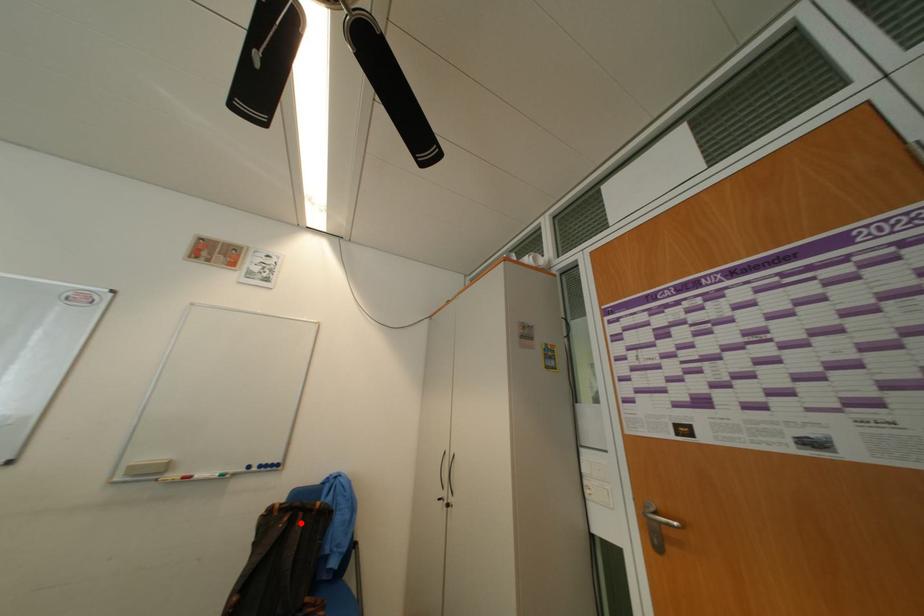
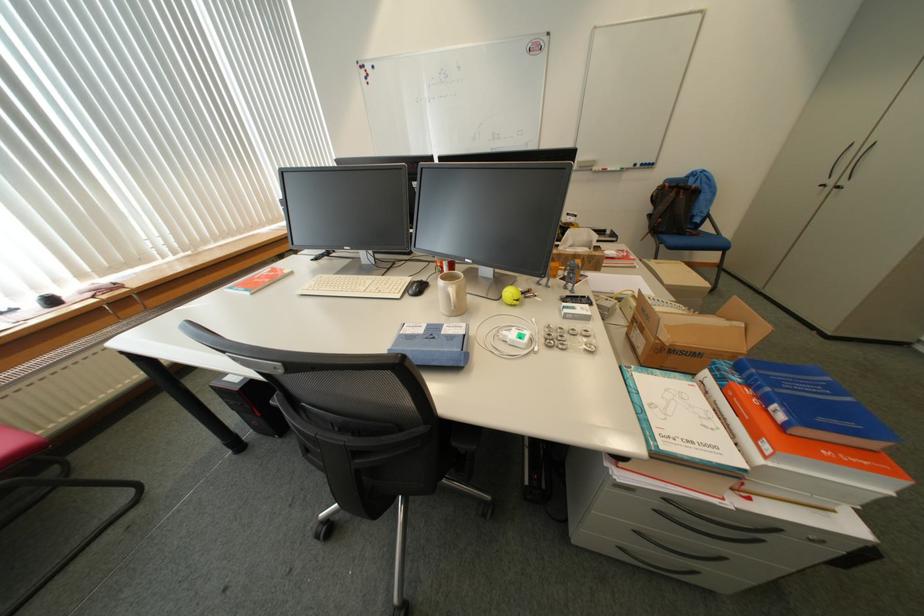
Find the pixel in the second image that matches the highlighted location in the first image.

(687, 195)